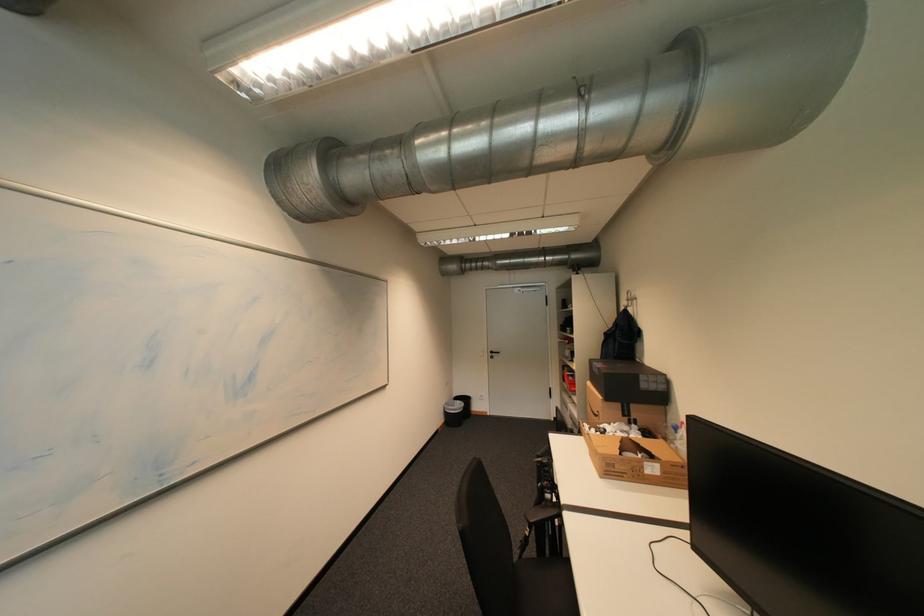
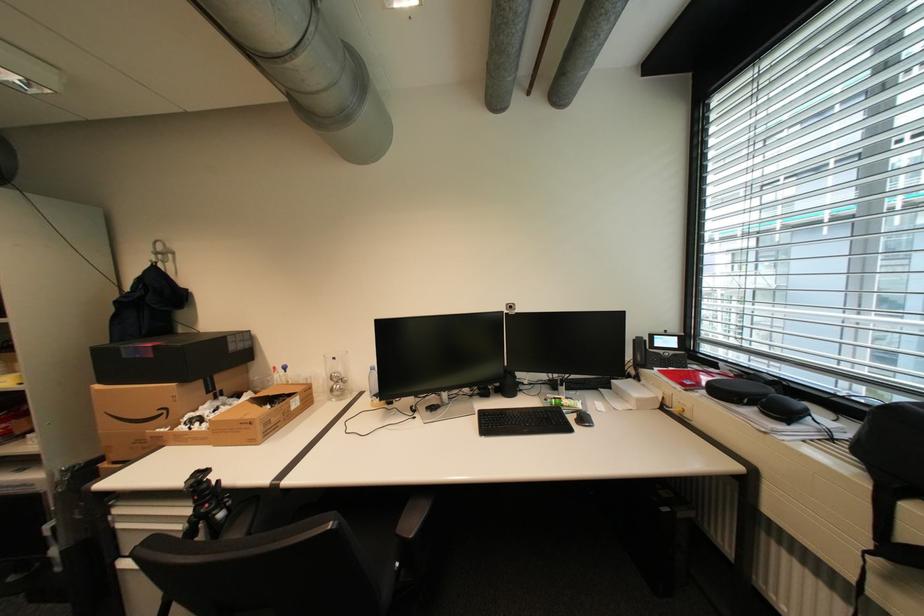
Find the pixel in the second image that matches point 606,375 in the first image.

(161, 357)